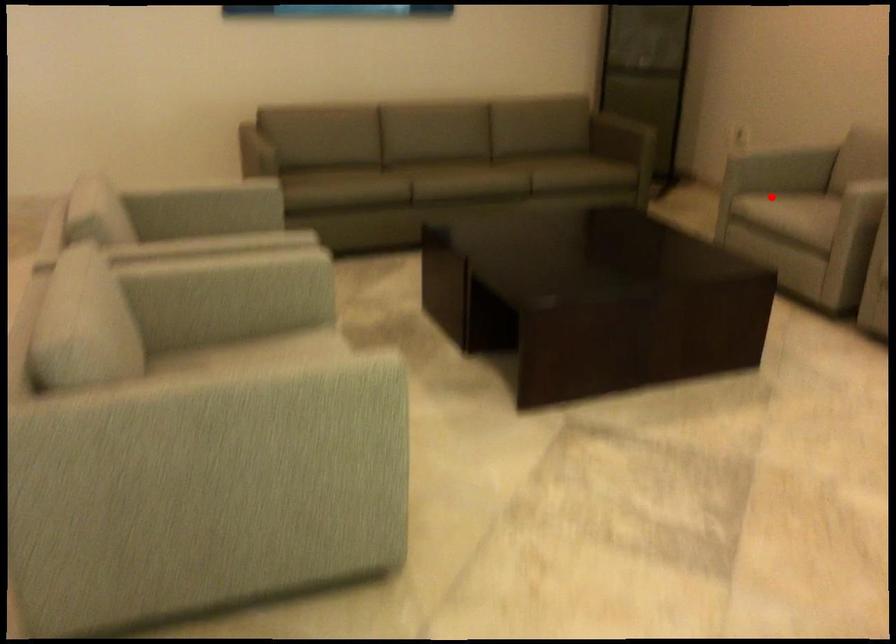
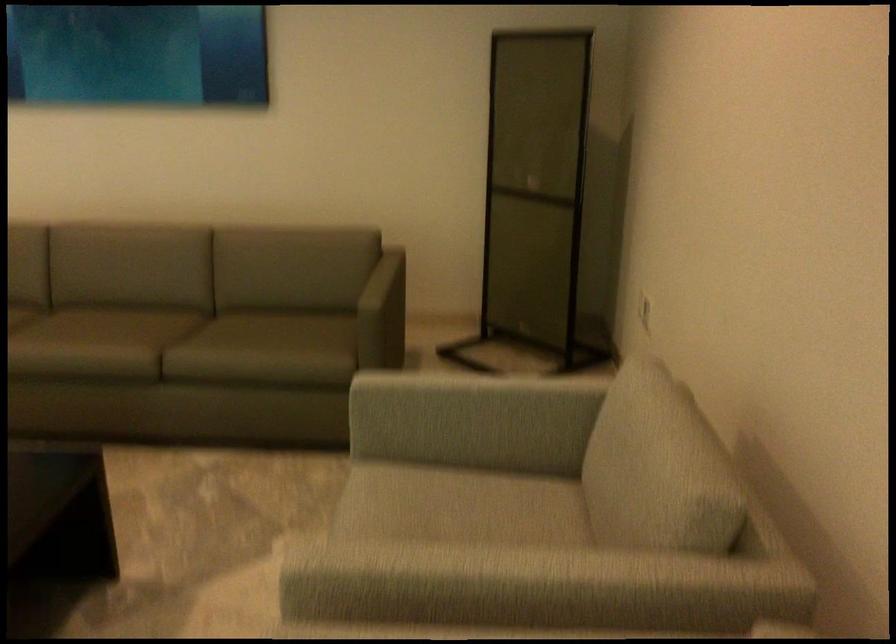
Question: I am providing you with two images of the same scene from different viewpoints. In image1, a red point is highlighted. Considering the same 3D point in image2, which of the following is correct?

Choices:
 (A) It is closer
 (B) It is farther

Answer: (A)